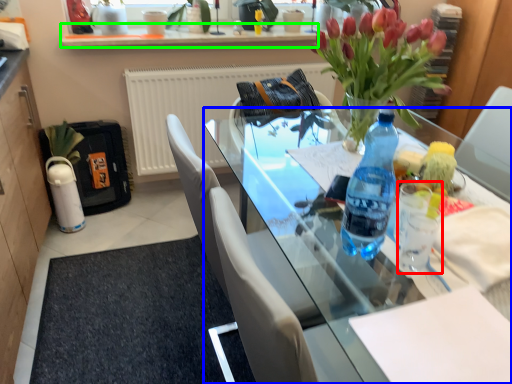
Question: Which object is positioned farthest from coffee cup (highlighted by a red box)? Select from desk (highlighted by a blue box) and window sill (highlighted by a green box).

Choices:
 (A) desk
 (B) window sill

Answer: (B)